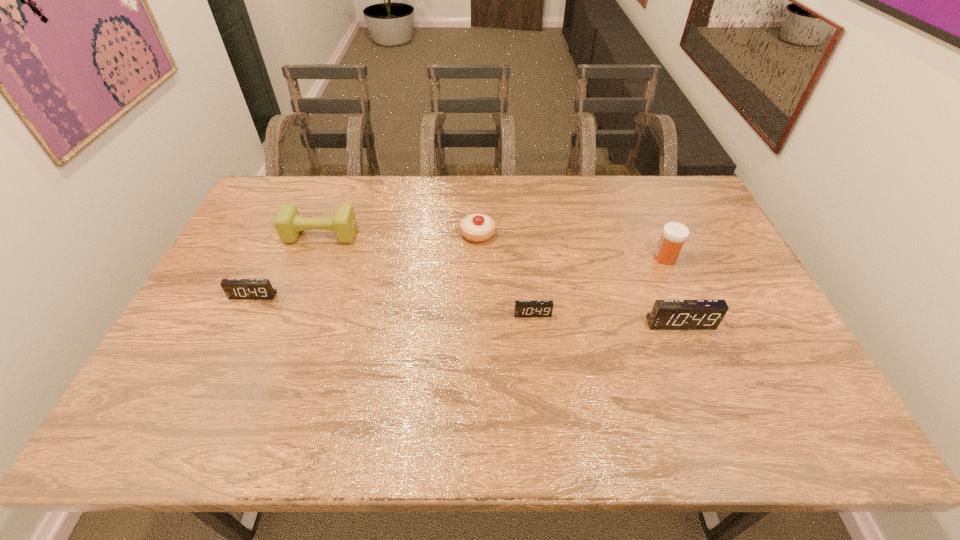
At what (x,y) coordinates should I click in order to perform the action: click on unoccupied area between the pastry and the second shortest object. Please return your answer as a coordinate pair (x, y). Looking at the image, I should click on (366, 265).

Find the location of a particular element. blank region between the third object from right to left and the pastry is located at coordinates 505,274.

Image resolution: width=960 pixels, height=540 pixels. Find the location of `vacant space that's between the rightmost alarm clock and the third farthest object`. vacant space that's between the rightmost alarm clock and the third farthest object is located at coordinates (673, 291).

This screenshot has height=540, width=960. I want to click on object that is the second closest one to the rightmost alarm clock, so click(523, 308).

Point out which object is positioned as the fourth nearest to the shortest alarm clock. Please provide its 2D coordinates. Your answer should be formatted as a tuple, i.e. [(x, y)], where the tuple contains the x and y coordinates of a point satisfying the conditions above.

[(288, 223)]

I want to click on alarm clock that is the closest one to the fifth tallest object, so click(523, 308).

What are the coordinates of `the closest alarm clock relative to the shortest alarm clock` in the screenshot? It's located at (666, 314).